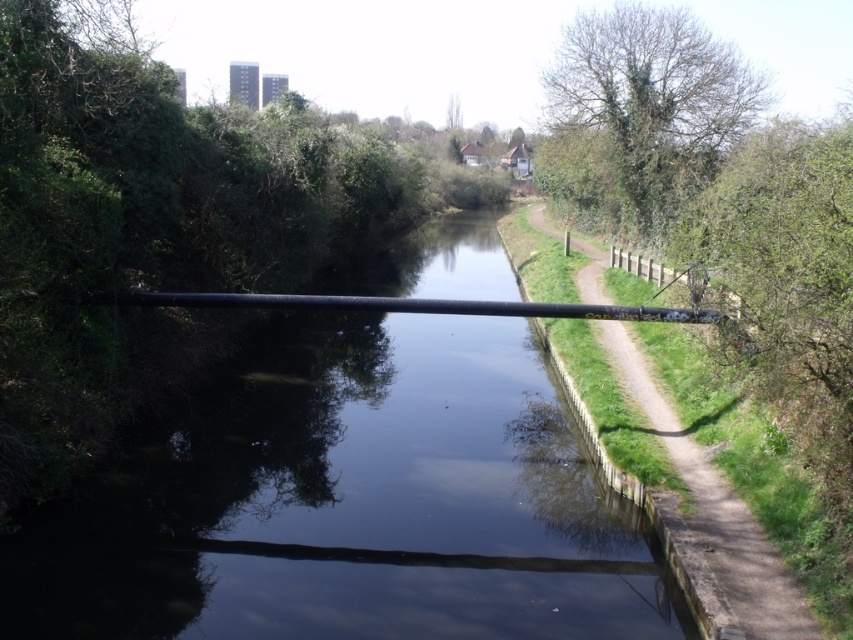
Is black pipe at center below dirt path at right?

Yes.

I want to click on black pipe at center, so click(x=351, y=504).

Is black pipe at center smaller than green leafy tree at upper right?

Yes, black pipe at center is smaller than green leafy tree at upper right.

Is point (479, 605) positioned behind point (614, 140)?

No, it is not.

Between point (605, 504) and point (619, 164), which one is positioned in front?

Point (605, 504)

Where is `black pipe at center`? black pipe at center is located at coordinates (351, 504).

Can you confirm if green leafy tree at upper right is shorter than dirt path at right?

In fact, green leafy tree at upper right may be taller than dirt path at right.

Does green leafy tree at upper right have a larger size compared to dirt path at right?

Correct, green leafy tree at upper right is larger in size than dirt path at right.

This screenshot has width=853, height=640. I want to click on green leafy tree at upper right, so click(x=642, y=112).

I want to click on green leafy tree at upper right, so pos(642,112).